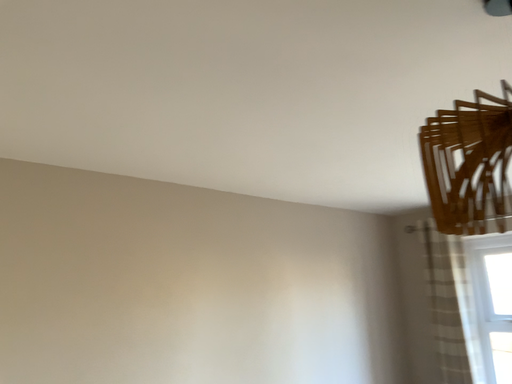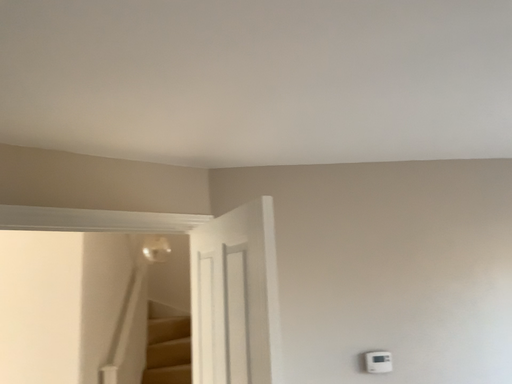
Question: Which way did the camera rotate in the video?

Choices:
 (A) rotated left
 (B) rotated right

Answer: (A)